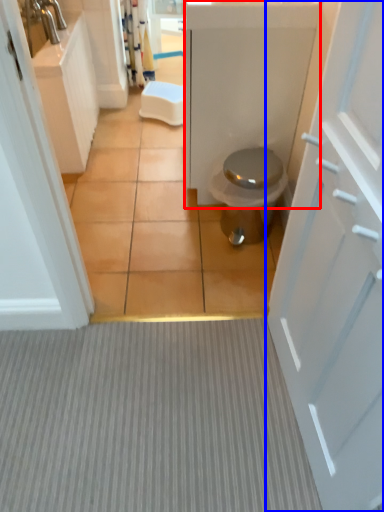
Question: Which object appears farthest to the camera in this image, bath (highlighted by a red box) or door (highlighted by a blue box)?

Choices:
 (A) bath
 (B) door

Answer: (A)